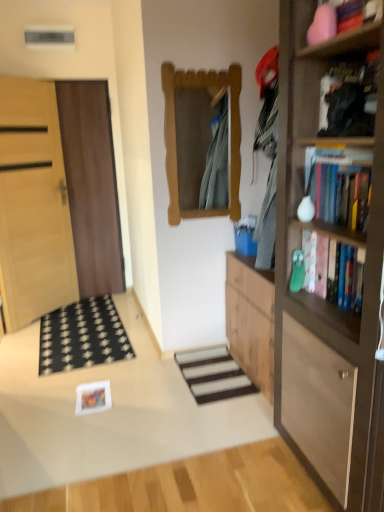
Question: From the image's perspective, is light wood door at left, the first door viewed from the left, located above black fabric doormat at lower left?

Choices:
 (A) yes
 (B) no

Answer: (A)

Question: Is black fabric doormat at lower left located within light wood door at left, which is the second door in right-to-left order?

Choices:
 (A) yes
 (B) no

Answer: (B)

Question: Can you confirm if light wood door at left, the first door viewed from the left, is positioned to the left of black fabric doormat at lower left?

Choices:
 (A) no
 (B) yes

Answer: (B)

Question: Is light wood door at left, which is the second door in right-to-left order, positioned in front of black fabric doormat at lower left?

Choices:
 (A) no
 (B) yes

Answer: (A)

Question: Is the surface of light wood door at left, which is the second door in right-to-left order, in direct contact with black fabric doormat at lower left?

Choices:
 (A) yes
 (B) no

Answer: (B)

Question: Do you think black fabric doormat at lower left is within black matte bookshelf at upper right, marked as the 1th book in a top-to-bottom arrangement, or outside of it?

Choices:
 (A) inside
 (B) outside

Answer: (B)

Question: From their relative heights in the image, would you say black fabric doormat at lower left is taller or shorter than black matte bookshelf at upper right, marked as the 1th book in a top-to-bottom arrangement?

Choices:
 (A) tall
 (B) short

Answer: (B)

Question: Considering their positions, is black fabric doormat at lower left located in front of or behind black matte bookshelf at upper right, placed as the 3th book when sorted from bottom to top?

Choices:
 (A) front
 (B) behind

Answer: (B)

Question: Based on their positions, is black fabric doormat at lower left located to the left or right of black matte bookshelf at upper right, marked as the 1th book in a top-to-bottom arrangement?

Choices:
 (A) left
 (B) right

Answer: (A)

Question: Considering the relative positions of wooden bookshelf at right and brown wooden door at left, arranged as the 1th door when viewed from the right, in the image provided, is wooden bookshelf at right to the left or to the right of brown wooden door at left, arranged as the 1th door when viewed from the right,?

Choices:
 (A) right
 (B) left

Answer: (A)

Question: Considering their positions, is wooden bookshelf at right located in front of or behind brown wooden door at left, the second door in the left-to-right sequence?

Choices:
 (A) behind
 (B) front

Answer: (B)

Question: In terms of size, does wooden bookshelf at right appear bigger or smaller than brown wooden door at left, arranged as the 1th door when viewed from the right?

Choices:
 (A) small
 (B) big

Answer: (B)

Question: Considering the positions of point (355, 394) and point (77, 92), is point (355, 394) closer or farther from the camera than point (77, 92)?

Choices:
 (A) closer
 (B) farther

Answer: (A)

Question: Based on their sizes in the image, would you say hardcover books at right, the second book in the bottom-to-top sequence, is bigger or smaller than black fabric doormat at lower left?

Choices:
 (A) small
 (B) big

Answer: (B)

Question: In terms of width, does hardcover books at right, the second book in the bottom-to-top sequence, look wider or thinner when compared to black fabric doormat at lower left?

Choices:
 (A) wide
 (B) thin

Answer: (B)